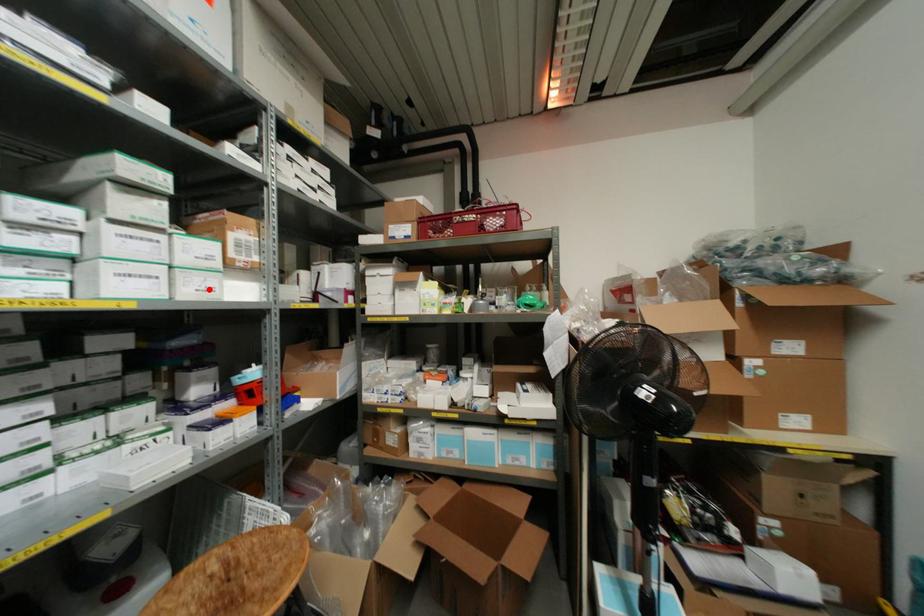
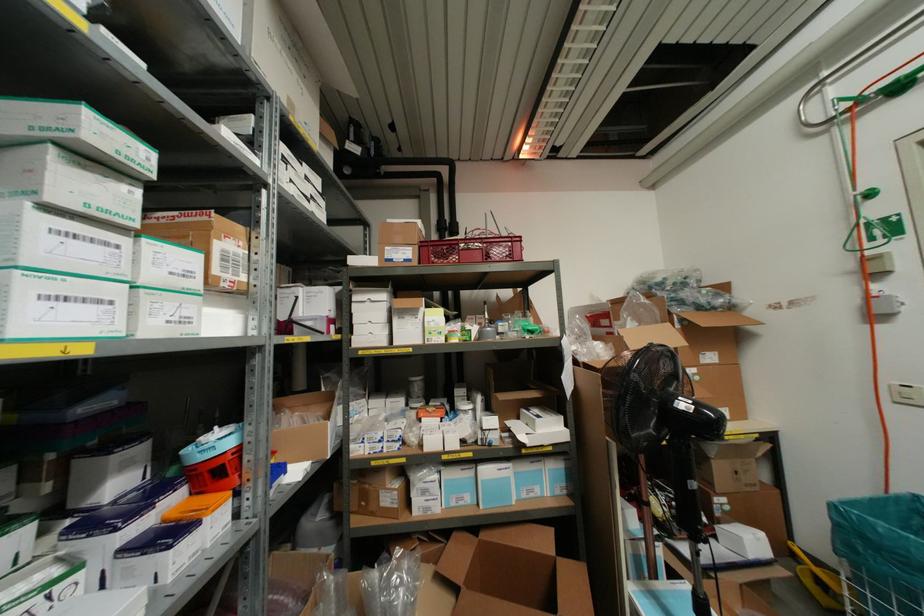
Where in the second image is the point corresponding to the highlighted location from the first image?

(185, 320)